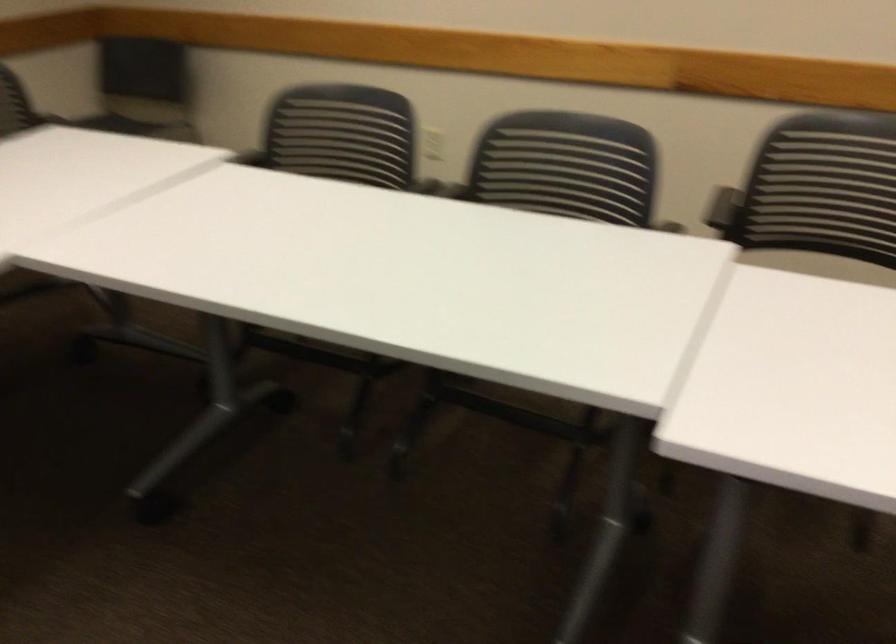
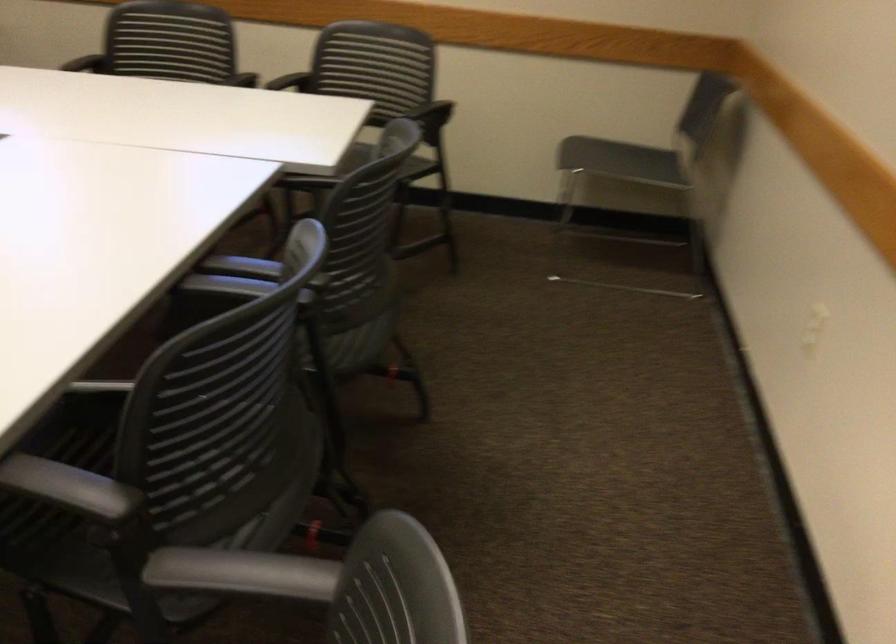
The point at (x=403, y=205) is marked in the first image. Where is the corresponding point in the second image?

(246, 274)